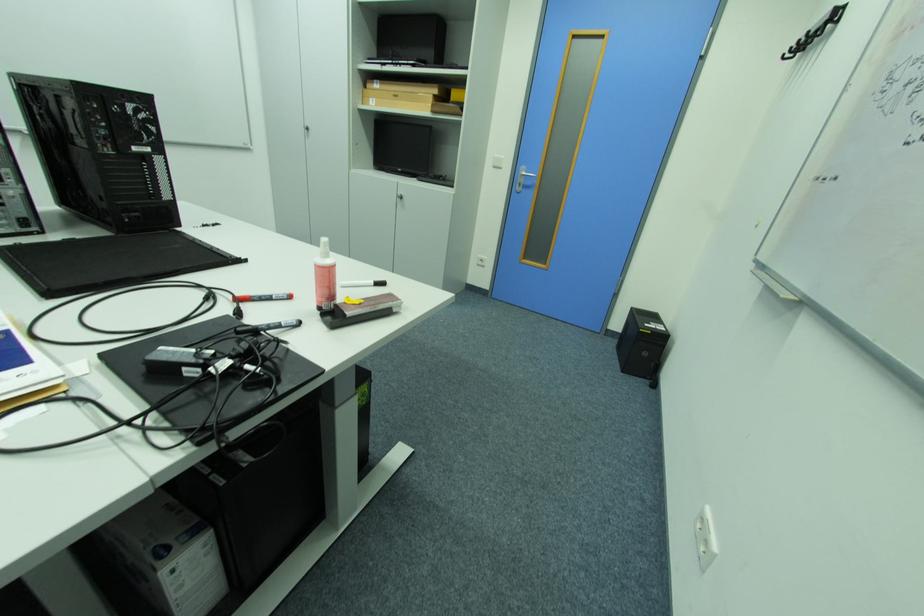
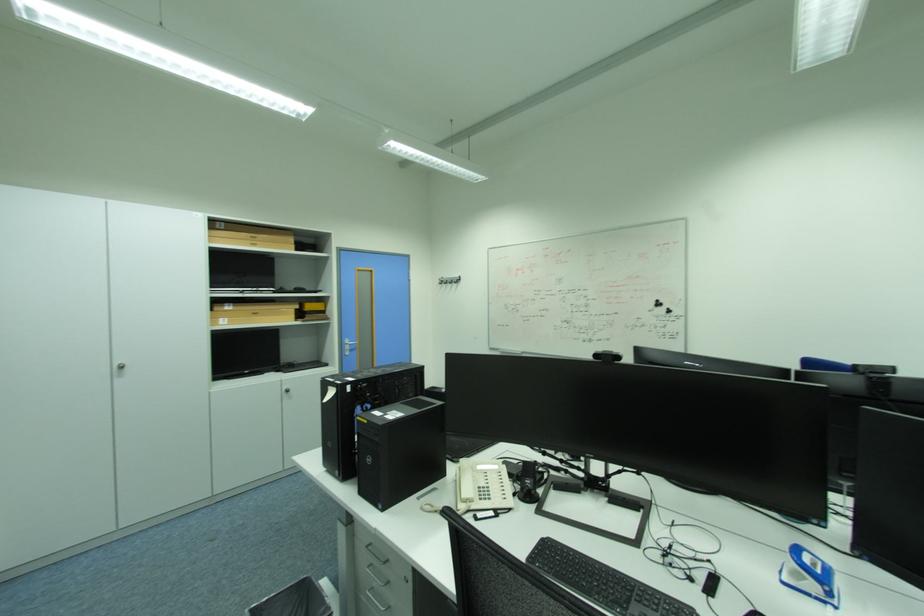
Locate, in the second image, the point that corresponds to point 379,100 in the first image.

(228, 320)